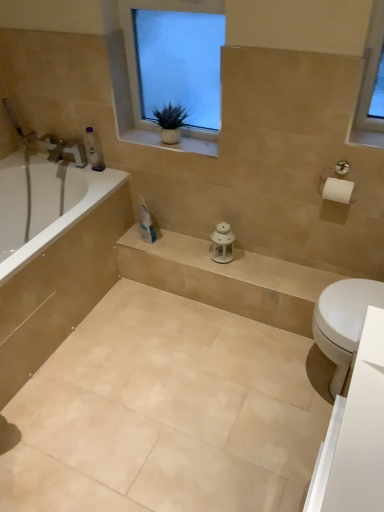
Question: From the image's perspective, would you say white textured window at upper center is positioned over beige stone balustrade at center?

Choices:
 (A) no
 (B) yes

Answer: (B)

Question: Is white textured window at upper center thinner than beige stone balustrade at center?

Choices:
 (A) no
 (B) yes

Answer: (B)

Question: From a real-world perspective, is white textured window at upper center physically above beige stone balustrade at center?

Choices:
 (A) yes
 (B) no

Answer: (A)

Question: Is the depth of white textured window at upper center less than that of beige stone balustrade at center?

Choices:
 (A) yes
 (B) no

Answer: (A)

Question: Can you confirm if white textured window at upper center is taller than beige stone balustrade at center?

Choices:
 (A) no
 (B) yes

Answer: (B)

Question: Is white textured window at upper center to the left of beige stone balustrade at center from the viewer's perspective?

Choices:
 (A) no
 (B) yes

Answer: (B)

Question: From a real-world perspective, is translucent plastic bottle at upper left beneath green matte plant at upper center?

Choices:
 (A) yes
 (B) no

Answer: (A)

Question: Does translucent plastic bottle at upper left appear on the left side of green matte plant at upper center?

Choices:
 (A) no
 (B) yes

Answer: (B)

Question: From the image's perspective, is translucent plastic bottle at upper left on top of green matte plant at upper center?

Choices:
 (A) yes
 (B) no

Answer: (B)

Question: Considering the relative sizes of translucent plastic bottle at upper left and green matte plant at upper center in the image provided, is translucent plastic bottle at upper left shorter than green matte plant at upper center?

Choices:
 (A) no
 (B) yes

Answer: (A)

Question: Is translucent plastic bottle at upper left positioned with its back to green matte plant at upper center?

Choices:
 (A) no
 (B) yes

Answer: (A)

Question: Are translucent plastic bottle at upper left and green matte plant at upper center far apart?

Choices:
 (A) no
 (B) yes

Answer: (A)

Question: Is the surface of translucent plastic bottle at upper left in direct contact with beige stone balustrade at center?

Choices:
 (A) no
 (B) yes

Answer: (A)